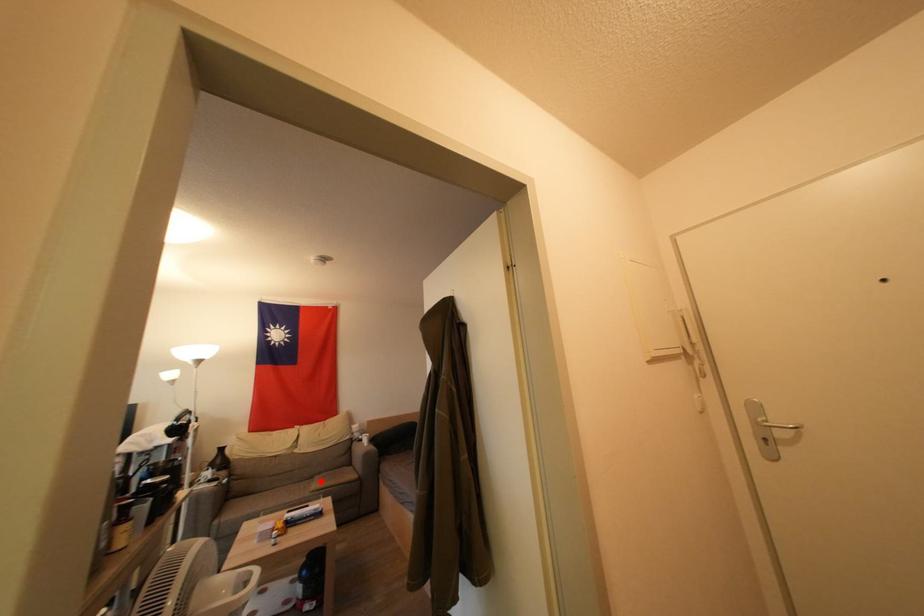
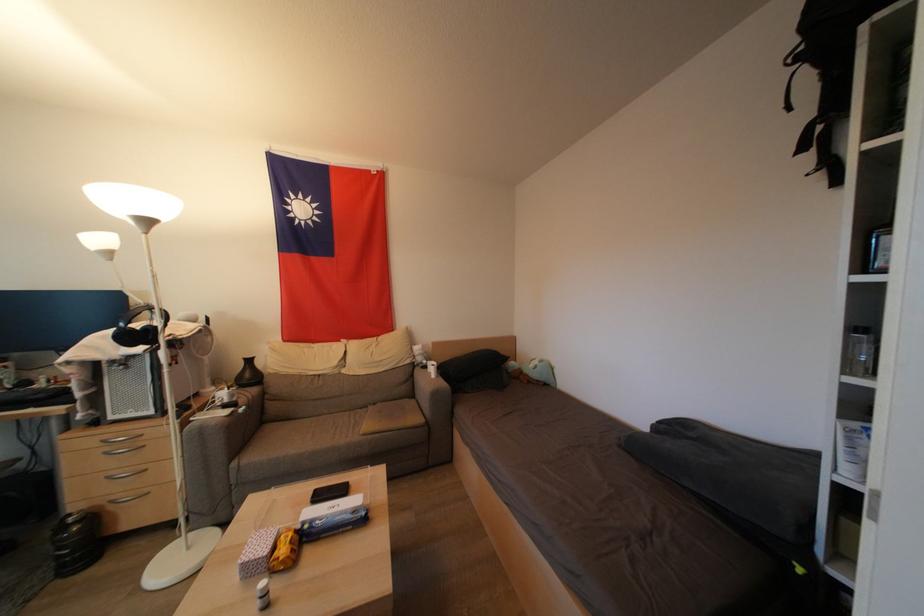
Where in the second image is the point corresponding to the highlighted location from the first image?

(375, 411)